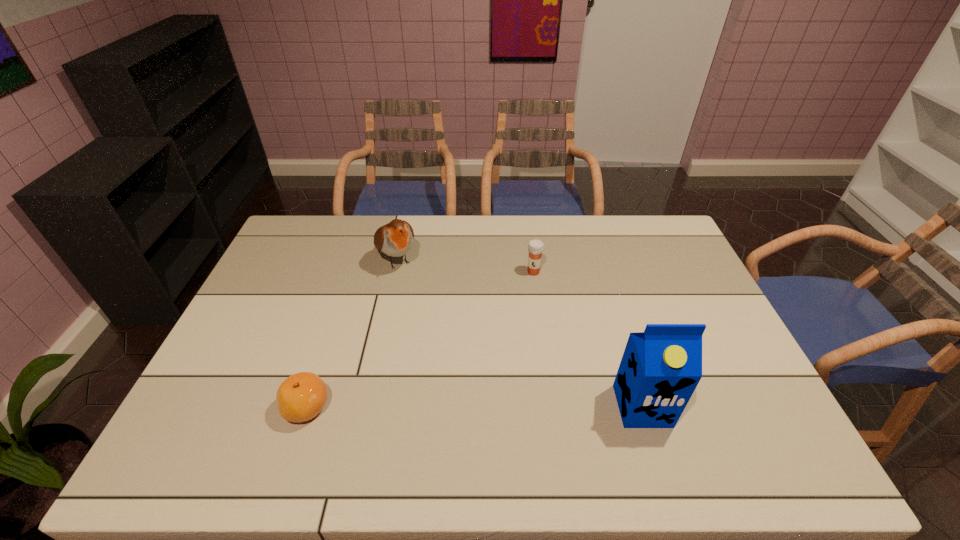
Locate an element on the screen. Image resolution: width=960 pixels, height=540 pixels. vacant space on the desktop that is between the clementine and the rightmost object and is positioned on the label side of the second shortest object is located at coordinates (476, 407).

Where is `vacant space on the desktop that is between the clementine and the tallest object and is positioned at the face of the third object from right to left`? The width and height of the screenshot is (960, 540). vacant space on the desktop that is between the clementine and the tallest object and is positioned at the face of the third object from right to left is located at coordinates (490, 407).